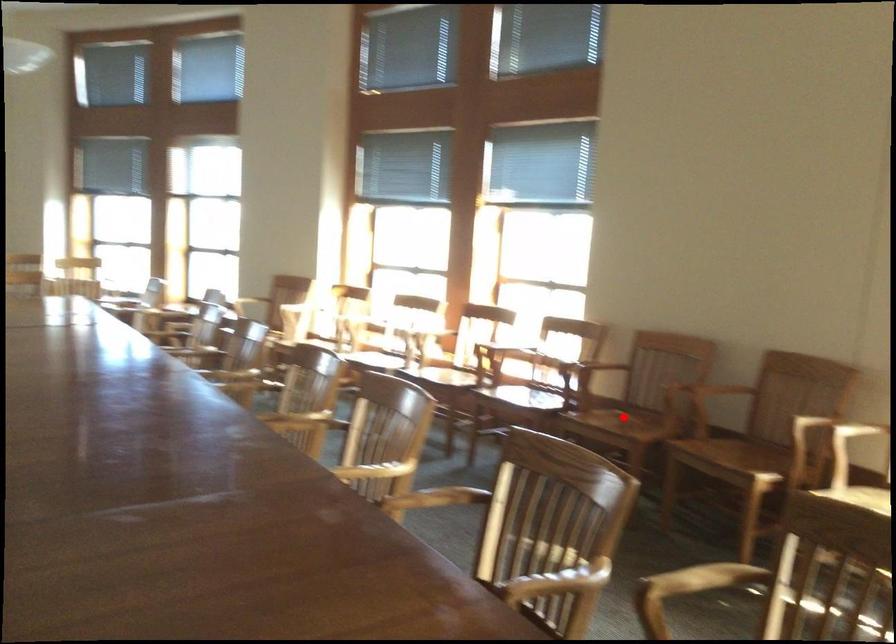
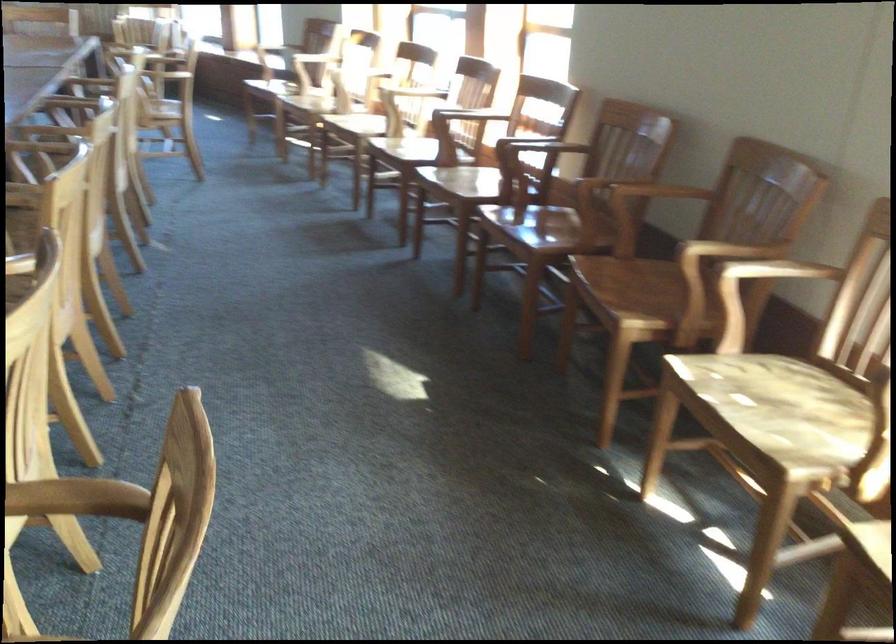
Question: I am providing you with two images of the same scene from different viewpoints. Given a red point in image1, look at the same physical point in image2. Is it:

Choices:
 (A) Closer to the viewpoint
 (B) Farther from the viewpoint

Answer: (A)